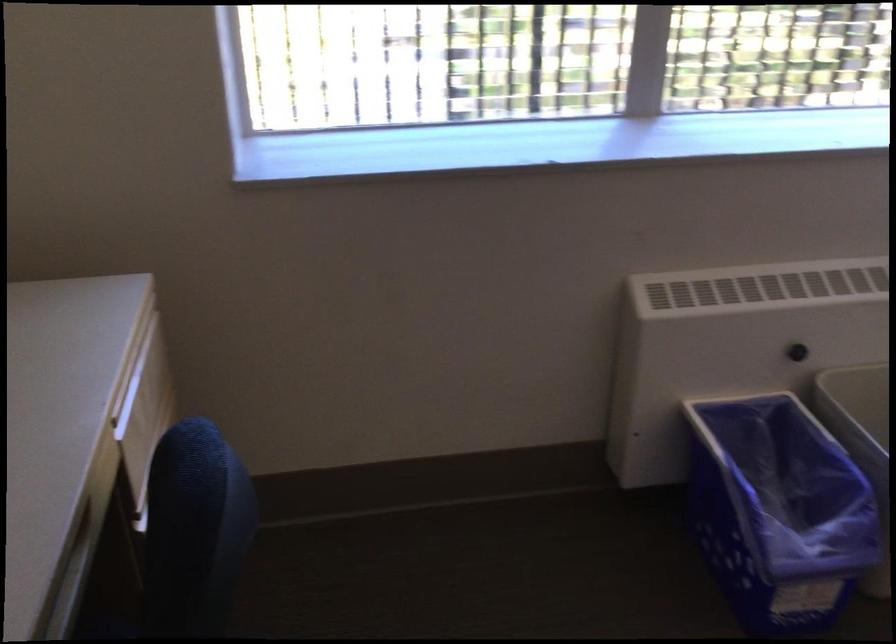
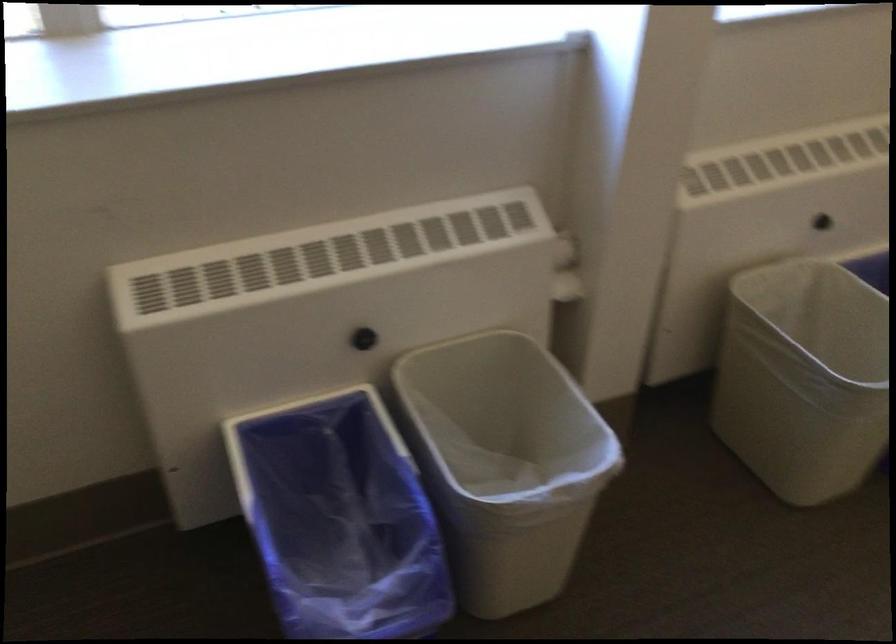
Where in the second image is the point corresponding to the point at 797,348 from the first image?

(364, 339)